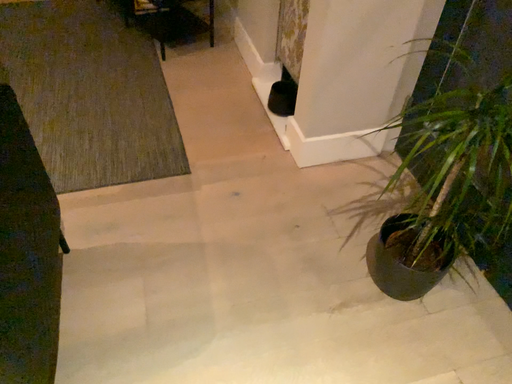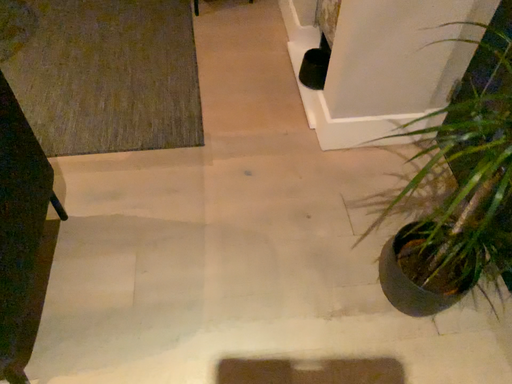
Question: Which way did the camera rotate in the video?

Choices:
 (A) rotated left
 (B) rotated right

Answer: (A)